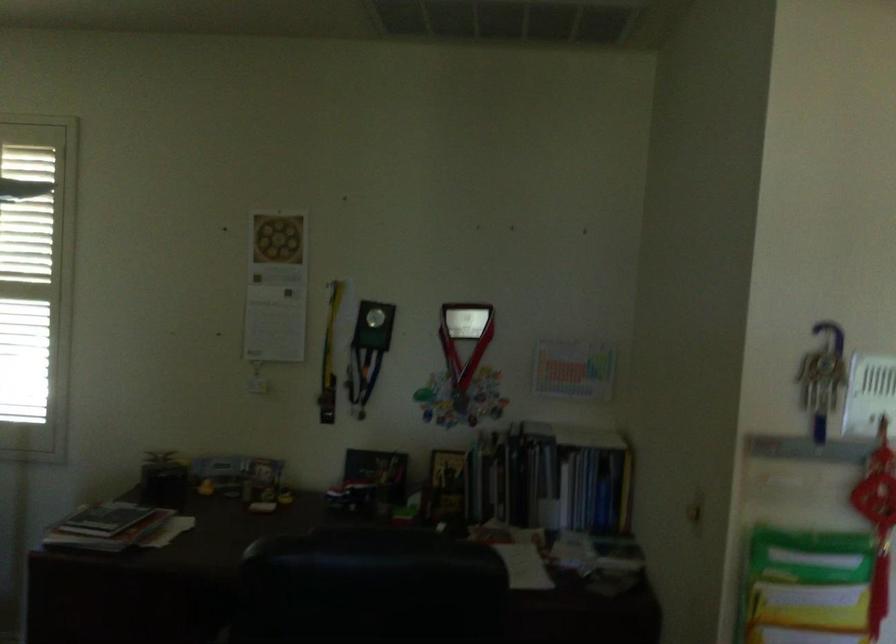
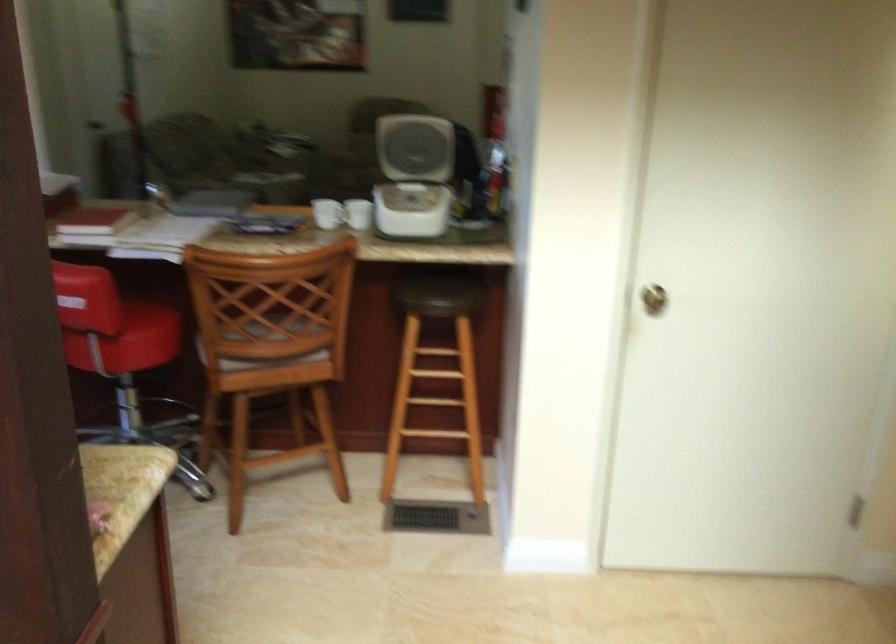
Question: I am providing you with two images of the same scene from different viewpoints. After the viewpoint changes to image2, which objects are now occluded?

Choices:
 (A) pink bag
 (B) white appliance lid
 (C) stack of magazines
 (D) red chair sitting surface

Answer: (C)